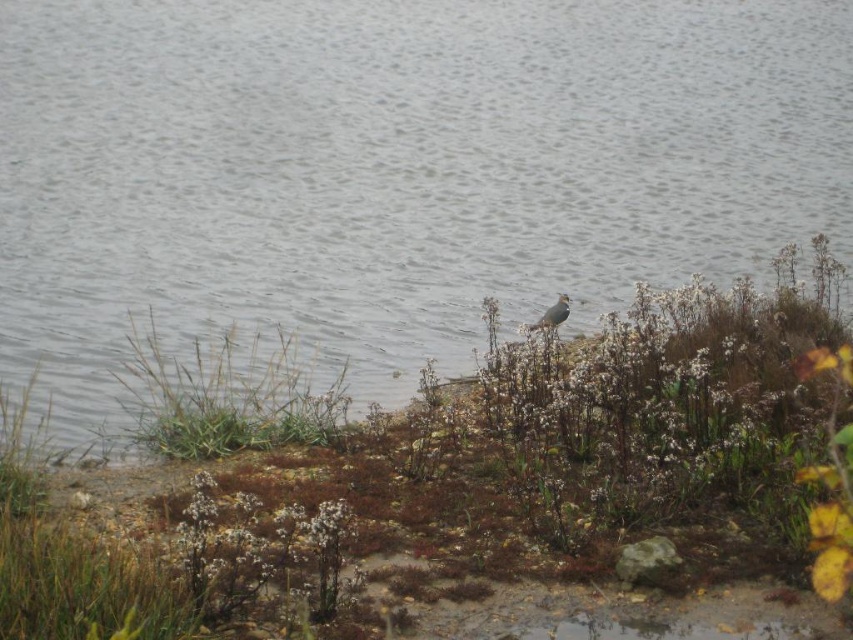
Is brown grass at center closer to the viewer compared to gray matte bird at center?

Yes, it is.

Does brown grass at center appear over gray matte bird at center?

No.

What are the coordinates of `brown grass at center` in the screenshot? It's located at (448, 474).

Is gray water at center to the left of brown grass at center from the viewer's perspective?

Correct, you'll find gray water at center to the left of brown grass at center.

Consider the image. Is gray water at center further to camera compared to brown grass at center?

That is True.

Who is more distant from viewer, (184, 288) or (611, 557)?

Point (184, 288)

This screenshot has width=853, height=640. Find the location of `gray water at center`. gray water at center is located at coordinates (393, 172).

Is gray water at center to the right of gray matte bird at center from the viewer's perspective?

In fact, gray water at center is to the left of gray matte bird at center.

At what (x,y) coordinates should I click in order to perform the action: click on gray water at center. Please return your answer as a coordinate pair (x, y). This screenshot has height=640, width=853. Looking at the image, I should click on (393, 172).